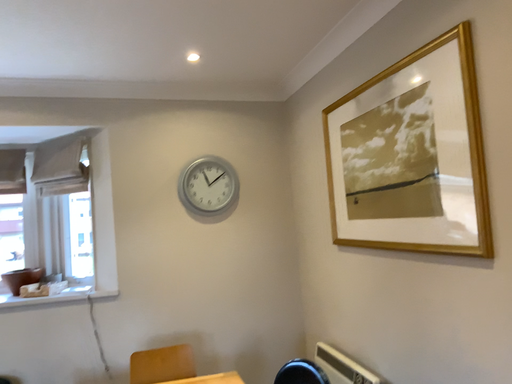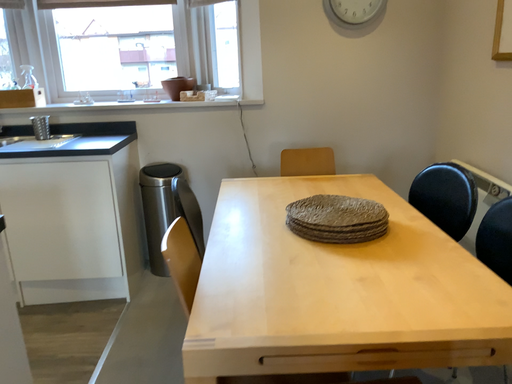
Question: How did the camera likely rotate when shooting the video?

Choices:
 (A) rotated left
 (B) rotated right

Answer: (A)